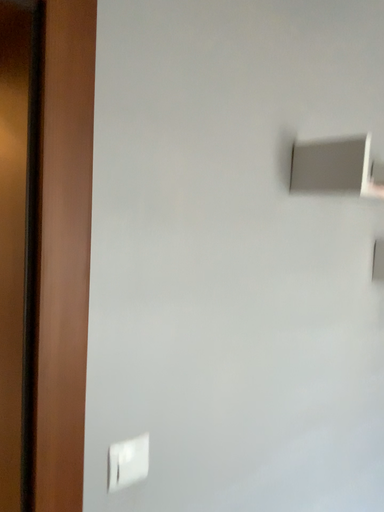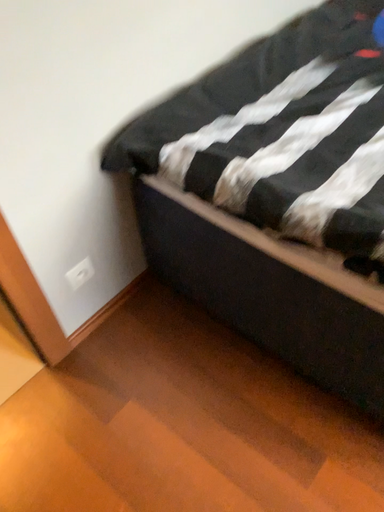
Question: How did the camera likely rotate when shooting the video?

Choices:
 (A) rotated upward
 (B) rotated downward

Answer: (B)